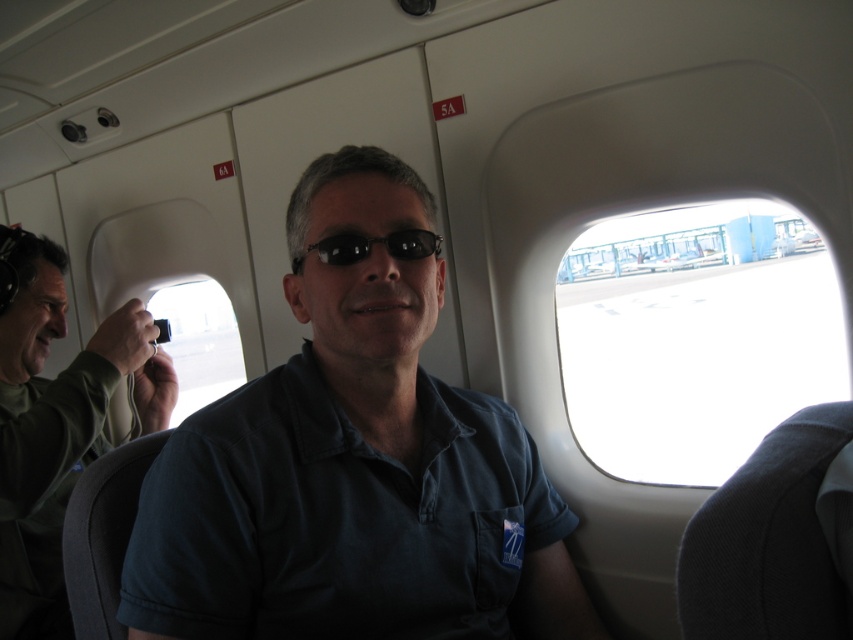
Between transparent plastic airplane window at center and black plastic sunglasses at center, which one has more height?

transparent plastic airplane window at center is taller.

Between point (213, 362) and point (334, 259), which one is positioned behind?

Positioned behind is point (213, 362).

Identify the location of transparent plastic airplane window at center. (199, 342).

Which is in front, point (751, 307) or point (15, 252)?

Point (15, 252) is in front.

Does transparent glass airplane window at upper right have a greater height compared to green matte shirt at center?

Yes, transparent glass airplane window at upper right is taller than green matte shirt at center.

Is point (663, 374) positioned after point (44, 444)?

Yes, point (663, 374) is farther from viewer.

Locate an element on the screen. This screenshot has height=640, width=853. transparent glass airplane window at upper right is located at coordinates (695, 337).

Can you confirm if green matte shirt at center is positioned above transparent plastic airplane window at center?

Correct, green matte shirt at center is located above transparent plastic airplane window at center.

Does green matte shirt at center appear on the left side of transparent plastic airplane window at center?

Incorrect, green matte shirt at center is not on the left side of transparent plastic airplane window at center.

Between point (48, 600) and point (196, 392), which one is positioned behind?

The point (196, 392) is behind.

You are a GUI agent. You are given a task and a screenshot of the screen. Output one action in this format:
    pyautogui.click(x=<x>, y=<y>)
    Task: Click on the green matte shirt at center
    This screenshot has height=640, width=853.
    Given the screenshot: What is the action you would take?
    pyautogui.click(x=56, y=422)